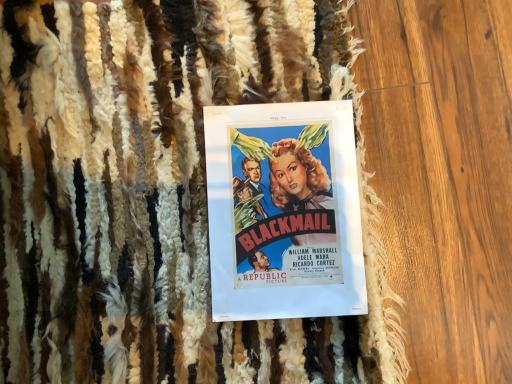
The image size is (512, 384). In order to click on free spot behind vivid paper poster at center in this screenshot , I will do `click(251, 52)`.